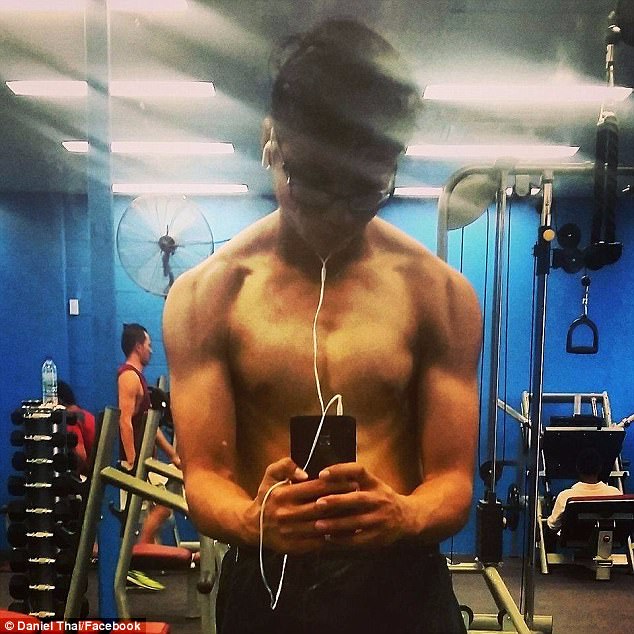
Locate an element on the screen. The image size is (634, 634). rectangular black phone is located at coordinates click(x=301, y=440).